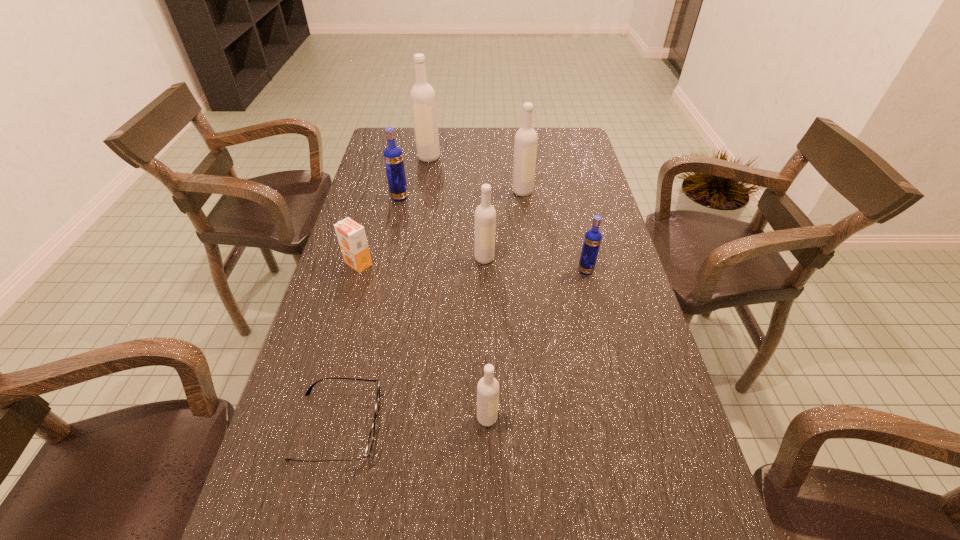
Locate an element on the screen. Image resolution: width=960 pixels, height=540 pixels. free spot at the far left corner of the desktop is located at coordinates [378, 153].

Identify the location of vacant space at the far right corner. (565, 136).

This screenshot has width=960, height=540. What are the coordinates of `vacant area that lies between the leftmost vodka and the seventh tallest object` in the screenshot? It's located at (379, 231).

I want to click on free space between the nearest vodka and the tallest vodka, so click(458, 287).

Where is `free spot between the nearest vodka and the rightmost white vodka`? The width and height of the screenshot is (960, 540). free spot between the nearest vodka and the rightmost white vodka is located at coordinates (505, 305).

This screenshot has height=540, width=960. In order to click on free space that is in between the third farthest white vodka and the spectacles in this screenshot , I will do `click(411, 342)`.

Find the location of a particular element. empty location between the left blue vodka and the shortest object is located at coordinates (369, 312).

Locate an element on the screen. The width and height of the screenshot is (960, 540). free spot between the biggest white vodka and the nearest white vodka is located at coordinates (458, 287).

Identify the location of vacant space that is in between the farthest object and the second nearest white vodka. (457, 208).

This screenshot has width=960, height=540. Find the location of `empty space that is in between the fifth shortest vodka and the bigger blue vodka`. empty space that is in between the fifth shortest vodka and the bigger blue vodka is located at coordinates (461, 194).